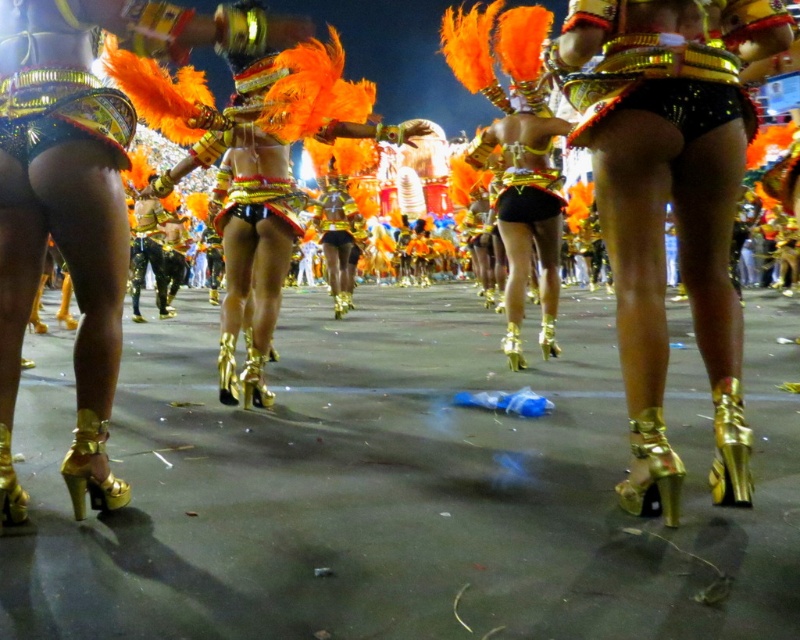
Question: Does shiny gold high-heeled shoes at center come behind shiny gold shorts at center?

Choices:
 (A) no
 (B) yes

Answer: (A)

Question: Considering the real-world distances, which object is closest to the shiny gold high-heeled shoes at center?

Choices:
 (A) shiny gold shorts at center
 (B) shiny gold high-heeled boots at center

Answer: (B)

Question: Is shiny gold high-heeled boots at center closer to camera compared to shiny gold shorts at center?

Choices:
 (A) no
 (B) yes

Answer: (B)

Question: Among these objects, which one is farthest from the camera?

Choices:
 (A) shiny gold high-heeled shoes at center
 (B) shiny gold high-heeled boots at center

Answer: (B)

Question: Is shiny gold high-heeled shoes at center bigger than shiny gold high-heeled boots at center?

Choices:
 (A) no
 (B) yes

Answer: (A)

Question: Estimate the real-world distances between objects in this image. Which object is farther from the shiny gold high-heeled boots at center?

Choices:
 (A) shiny gold high-heeled shoes at center
 (B) shiny gold shorts at center

Answer: (B)